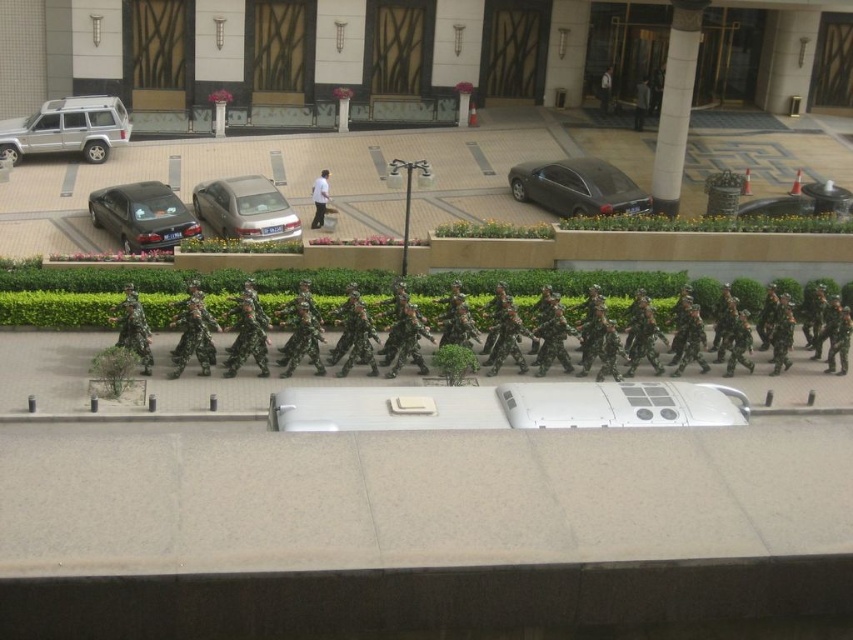
You are a delivery person approaching the building entrance. You see the satin black sedan at center and the silver metallic sedan at center. Which car should you avoid parking behind to ensure a clear path to the entrance?

You should avoid parking behind the satin black sedan at center because the silver metallic sedan at center is already positioned behind it, which might block your access to the entrance.